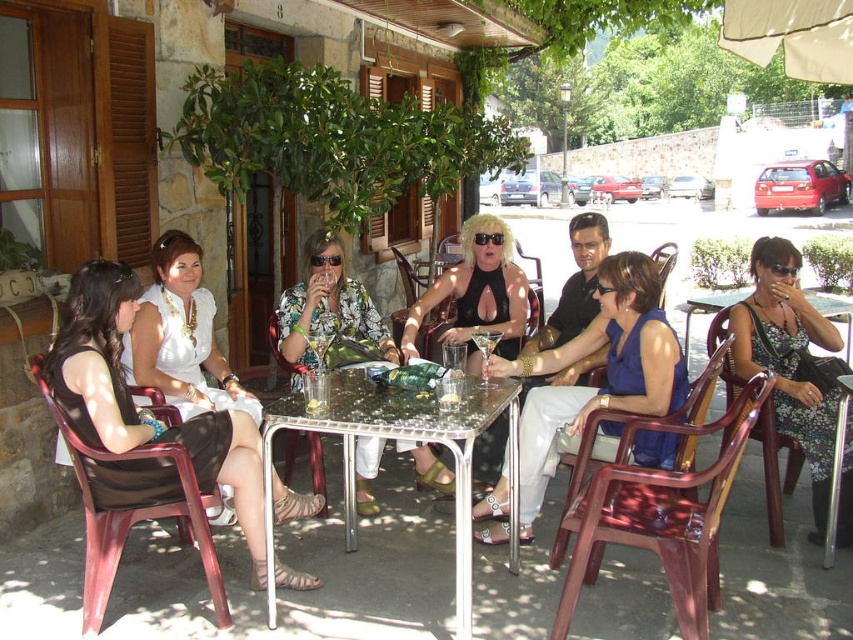
Which is above, matte black dress at left or translucent plastic chair at center?

matte black dress at left is higher up.

Who is shorter, matte black dress at left or translucent plastic chair at center?

With less height is translucent plastic chair at center.

Describe the element at coordinates (132, 403) in the screenshot. I see `matte black dress at left` at that location.

Locate an element on the screen. The width and height of the screenshot is (853, 640). matte black dress at left is located at coordinates (132, 403).

The image size is (853, 640). What do you see at coordinates (132, 403) in the screenshot?
I see `matte black dress at left` at bounding box center [132, 403].

At what (x,y) coordinates should I click in order to perform the action: click on matte black dress at left. Please return your answer as a coordinate pair (x, y). Looking at the image, I should click on (132, 403).

Is matte black dress at left closer to the viewer compared to matte black dress at center?

Yes, matte black dress at left is closer to the viewer.

Does point (224, 451) lie behind point (526, 452)?

No, (224, 451) is in front of (526, 452).

Locate an element on the screen. This screenshot has width=853, height=640. matte black dress at left is located at coordinates (132, 403).